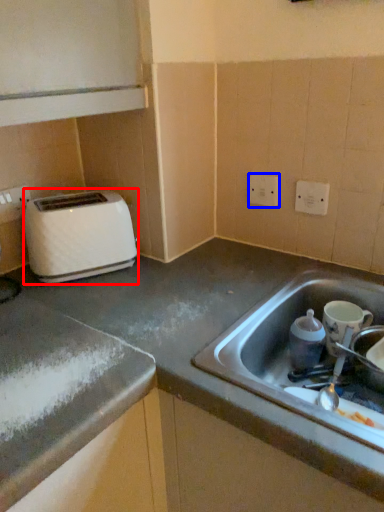
Question: Which of the following is the closest to the observer, toaster (highlighted by a red box) or electric outlet (highlighted by a blue box)?

Choices:
 (A) toaster
 (B) electric outlet

Answer: (A)